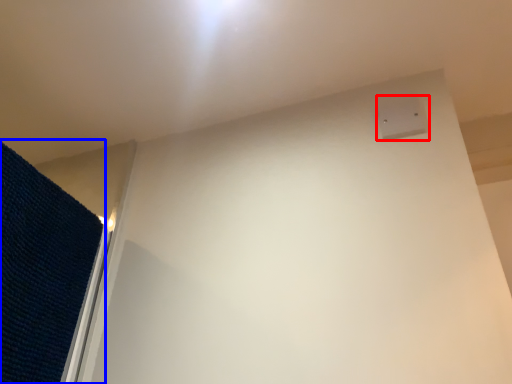
Question: Which of the following is the farthest to the observer, electric outlet (highlighted by a red box) or mat (highlighted by a blue box)?

Choices:
 (A) electric outlet
 (B) mat

Answer: (A)